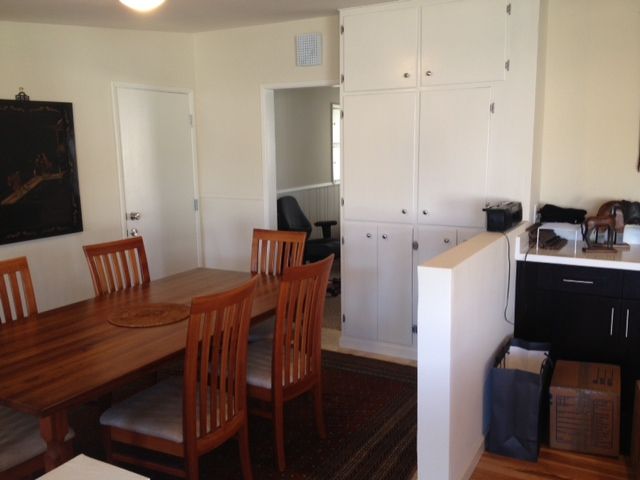
Identify the location of black cabinet. (577, 314), (632, 324).